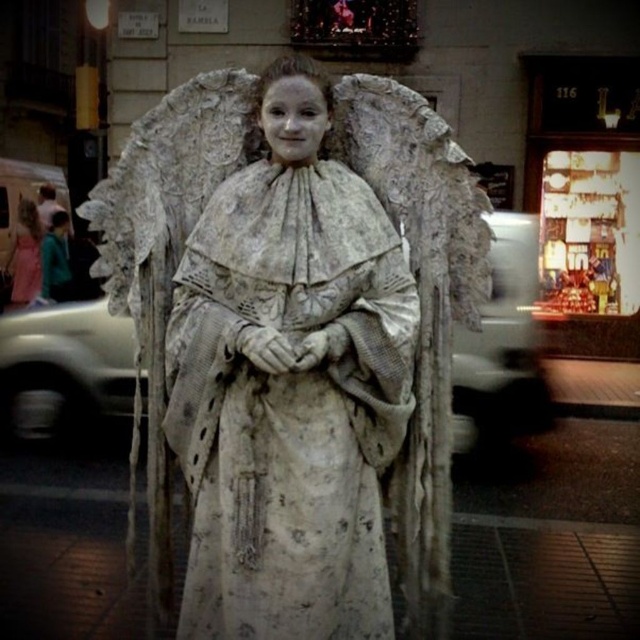
Is the position of white paper-like wings at center more distant than that of teal fabric jacket at left?

No, white paper-like wings at center is closer to the viewer.

Who is taller, white paper-like wings at center or teal fabric jacket at left?

Standing taller between the two is white paper-like wings at center.

Between point (225, 90) and point (68, 296), which one is positioned in front?

Positioned in front is point (225, 90).

This screenshot has width=640, height=640. In order to click on white paper-like wings at center in this screenshot , I will do `click(296, 342)`.

Between matte white dress at left and teal fabric jacket at left, which one is positioned lower?

teal fabric jacket at left is below.

Can you confirm if matte white dress at left is wider than teal fabric jacket at left?

In fact, matte white dress at left might be narrower than teal fabric jacket at left.

You are a GUI agent. You are given a task and a screenshot of the screen. Output one action in this format:
    pyautogui.click(x=<x>, y=<y>)
    Task: Click on the matte white dress at left
    
    Given the screenshot: What is the action you would take?
    pyautogui.click(x=26, y=253)

Who is more forward, (310,545) or (22,212)?

Positioned in front is point (310,545).

Does point (170, 392) come behind point (32, 202)?

No, it is in front of (32, 202).

Locate an element on the screen. Image resolution: width=640 pixels, height=640 pixels. white paper-like wings at center is located at coordinates (296, 342).